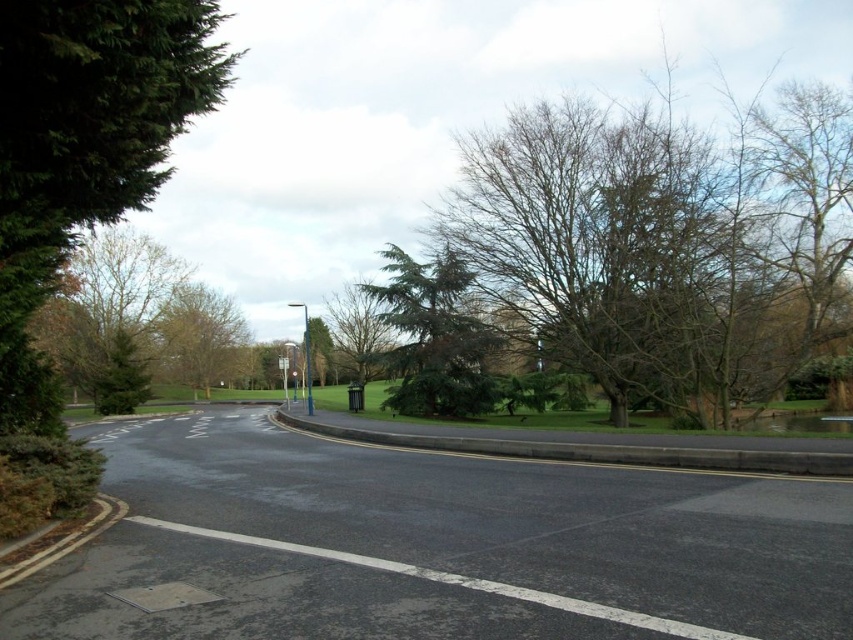
Is green leafy tree at left smaller than blue metallic pole at center?

Yes.

Who is positioned more to the right, green leafy tree at left or blue metallic pole at center?

Positioned to the right is green leafy tree at left.

Which is in front, point (192, 83) or point (306, 404)?

Point (192, 83) is more forward.

Where is `green leafy tree at left`? green leafy tree at left is located at coordinates (84, 147).

Is green leafy tree at left taller than green needle-like tree at center?

In fact, green leafy tree at left may be shorter than green needle-like tree at center.

Does green leafy tree at left lie in front of green needle-like tree at center?

Yes.

Describe the element at coordinates (84, 147) in the screenshot. I see `green leafy tree at left` at that location.

I want to click on green leafy tree at left, so click(84, 147).

Between green leafy tree at left and green textured tree at center, which one is positioned lower?

green textured tree at center

Identify the location of green leafy tree at left. The width and height of the screenshot is (853, 640). (84, 147).